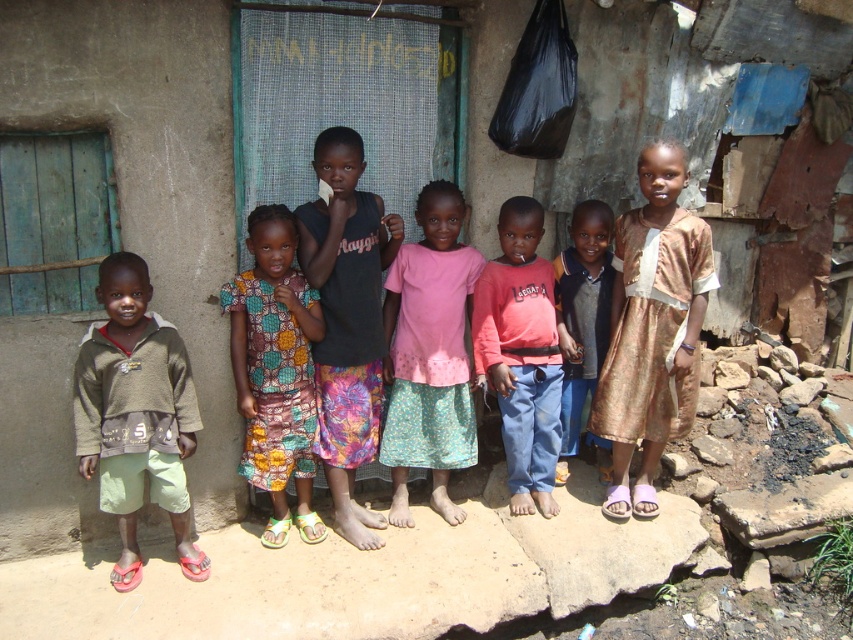
Question: Which object is closer to the camera taking this photo?

Choices:
 (A) black cotton shirt at center
 (B) gold brocade dress at right
 (C) printed fabric dress at center
 (D) green cotton shorts at left

Answer: (D)

Question: From the image, what is the correct spatial relationship of green cotton shorts at left in relation to black cotton shirt at center?

Choices:
 (A) left
 (B) right

Answer: (A)

Question: Which point is farther from the camera taking this photo?

Choices:
 (A) (494, 324)
 (B) (282, 451)
 (C) (473, 266)

Answer: (A)

Question: Is matte pink shirt at center further to the viewer compared to pink fabric dress at center?

Choices:
 (A) yes
 (B) no

Answer: (B)

Question: Estimate the real-world distances between objects in this image. Which object is farther from the printed fabric dress at center?

Choices:
 (A) matte pink shirt at center
 (B) pink fabric dress at center
 (C) gold brocade dress at right
 (D) green cotton shorts at left

Answer: (C)

Question: From the image, what is the correct spatial relationship of green cotton shorts at left in relation to printed fabric dress at center?

Choices:
 (A) below
 (B) above

Answer: (A)